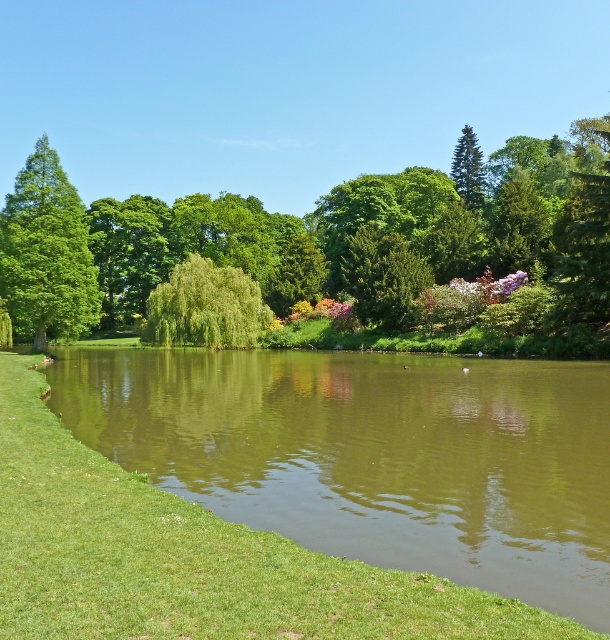
You are a landscape architect designing a new park. You need to place a 3m wide statue between the green reflective water at center and the green glossy tree at upper left. Can the statue fit between them?

The green reflective water at center is wider than the green glossy tree at upper left. Therefore, the statue cannot fit between them because the space between them is narrower than the statue.

You are a photographer planning to take a photo of the green reflective water at center and the green glossy tree at upper left. Which object is located above the other in the image?

The green glossy tree at upper left is positioned above the green reflective water at center.

You are a bird flying over the park and want to land on a tree. Which tree would you reach first if you fly straight towards the green leafy tree at center and green glossy tree at upper right?

You would reach the green leafy tree at center first because it is closer to you than the green glossy tree at upper right, which is further away.